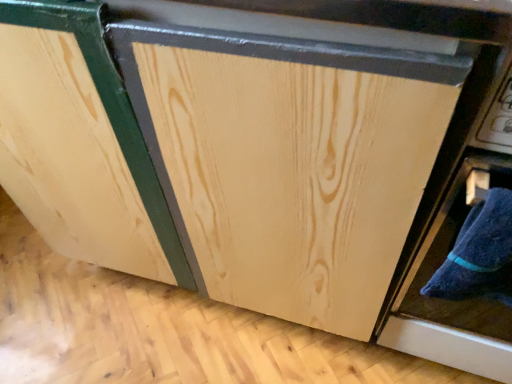
Locate an element on the screen. This screenshot has height=384, width=512. natural wood oven at lower right is located at coordinates (456, 248).

What is the approximate height of natural wood oven at lower right?

natural wood oven at lower right is 26.29 inches in height.

This screenshot has height=384, width=512. What do you see at coordinates (456, 248) in the screenshot?
I see `natural wood oven at lower right` at bounding box center [456, 248].

Image resolution: width=512 pixels, height=384 pixels. Identify the location of natural wood oven at lower right. (456, 248).